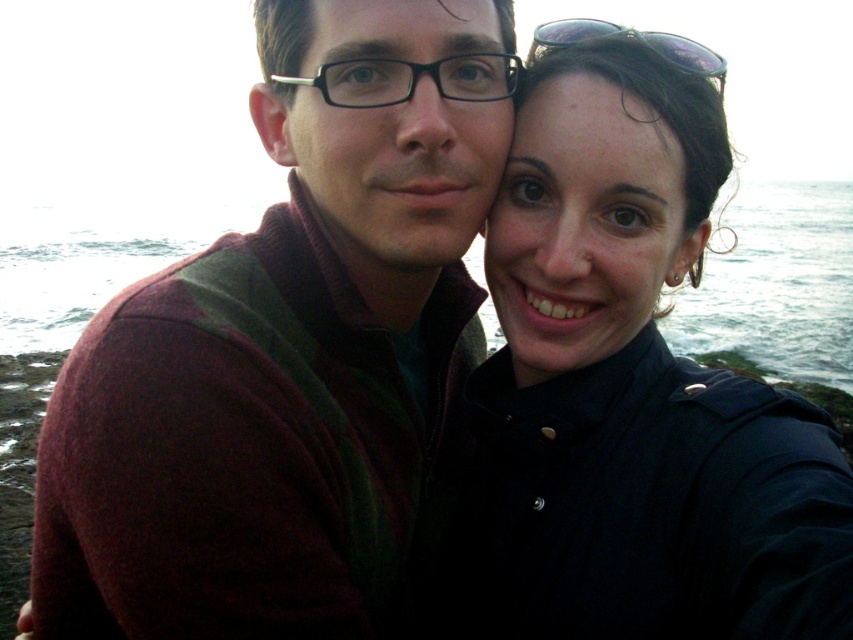
Question: In this image, where is maroon sweater at left located relative to matte black shirt at center?

Choices:
 (A) below
 (B) above

Answer: (B)

Question: Which of the following is the farthest from the observer?

Choices:
 (A) matte black shirt at center
 (B) maroon sweater at left

Answer: (B)

Question: Does maroon sweater at left have a larger size compared to matte black shirt at center?

Choices:
 (A) no
 (B) yes

Answer: (A)

Question: Is maroon sweater at left to the right of matte black shirt at center from the viewer's perspective?

Choices:
 (A) no
 (B) yes

Answer: (A)